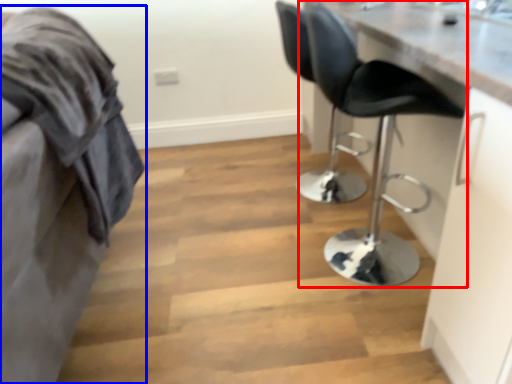
Question: Which of the following is the closest to the observer, chair (highlighted by a red box) or furniture (highlighted by a blue box)?

Choices:
 (A) chair
 (B) furniture

Answer: (B)